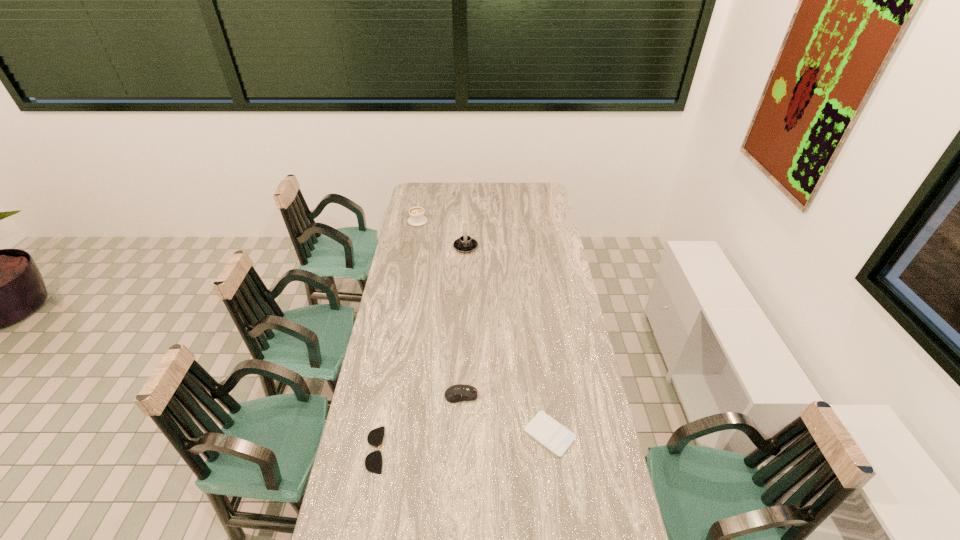
At what (x,y) coordinates should I click in order to perform the action: click on free space at the far edge. Please return your answer as a coordinate pair (x, y). This screenshot has height=540, width=960. Looking at the image, I should click on (520, 198).

Locate an element on the screen. vacant space at the left edge of the desktop is located at coordinates (405, 353).

Image resolution: width=960 pixels, height=540 pixels. What are the coordinates of `blank space at the right edge of the desktop` in the screenshot? It's located at (569, 318).

Find the location of a particular element. blank space at the far left corner of the desktop is located at coordinates (419, 193).

Where is `vacant space at the far right corner of the desktop`? vacant space at the far right corner of the desktop is located at coordinates (533, 195).

Find the location of a particular element. The image size is (960, 540). free spot between the calculator and the tallest object is located at coordinates (508, 341).

You are a GUI agent. You are given a task and a screenshot of the screen. Output one action in this format:
    pyautogui.click(x=<x>, y=<y>)
    Task: Click on the empty space between the candle holder and the calculator
    
    Given the screenshot: What is the action you would take?
    pyautogui.click(x=508, y=341)

In order to click on empty space that is in between the farthest object and the fourth nearest object in this screenshot , I will do `click(442, 234)`.

This screenshot has height=540, width=960. In order to click on free space between the fourth shortest object and the calculator in this screenshot , I will do `click(484, 327)`.

Where is `vacant space that's between the spectacles and the calculator`? vacant space that's between the spectacles and the calculator is located at coordinates (463, 442).